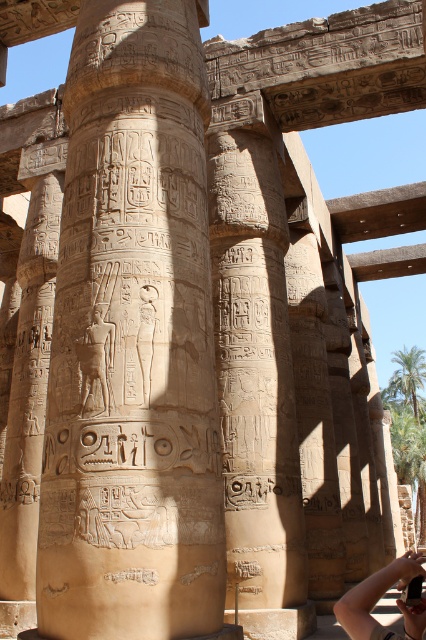
Question: Which object is closer to the camera taking this photo?

Choices:
 (A) beige stone column at center
 (B) carved stone column at center

Answer: (A)

Question: Considering the real-world distances, which object is closest to the carved stone column at center?

Choices:
 (A) skin-toned hand holding camera at center
 (B) beige stone column at center

Answer: (B)

Question: Which point is farther to the camera?

Choices:
 (A) (382, 628)
 (B) (273, 496)
 (C) (201, 99)

Answer: (B)

Question: Does carved stone column at center appear over skin-toned hand holding camera at center?

Choices:
 (A) yes
 (B) no

Answer: (A)

Question: In this image, where is beige stone column at center located relative to skin-toned hand holding camera at center?

Choices:
 (A) below
 (B) above

Answer: (B)

Question: Can you confirm if beige stone column at center is thinner than carved stone column at center?

Choices:
 (A) yes
 (B) no

Answer: (B)